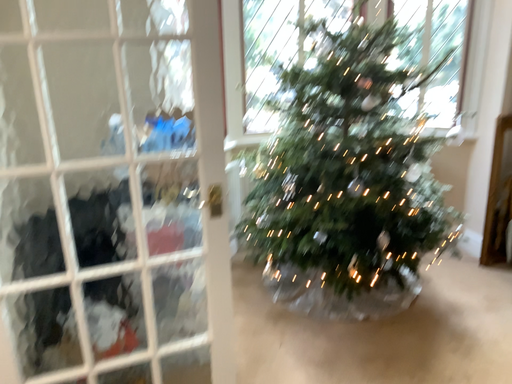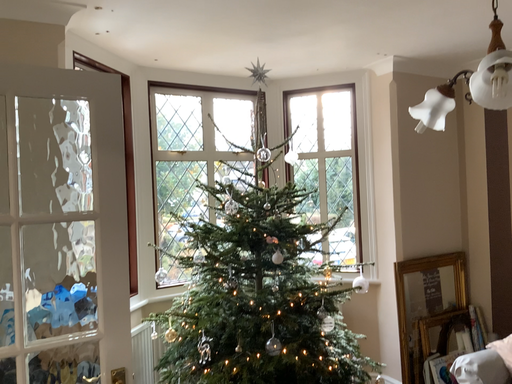
Question: Which way did the camera rotate in the video?

Choices:
 (A) rotated right
 (B) rotated left

Answer: (A)